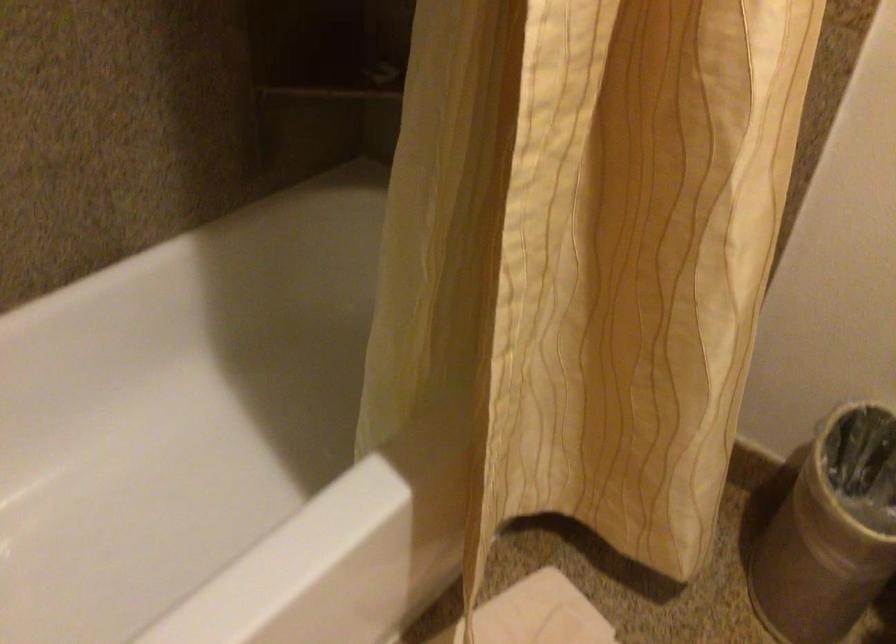
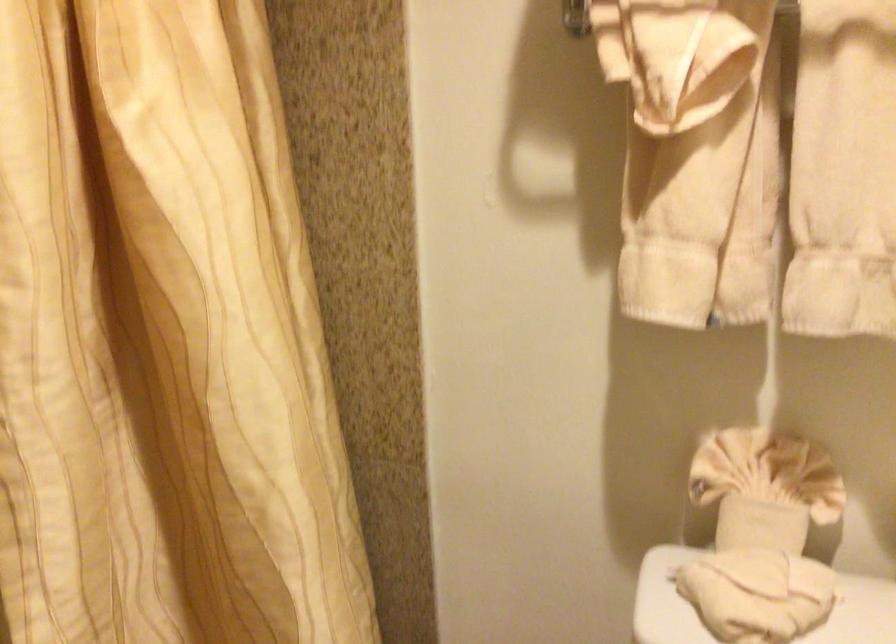
The images are taken continuously from a first-person perspective. In which direction is your viewpoint rotating?

The camera rotated toward right-up.